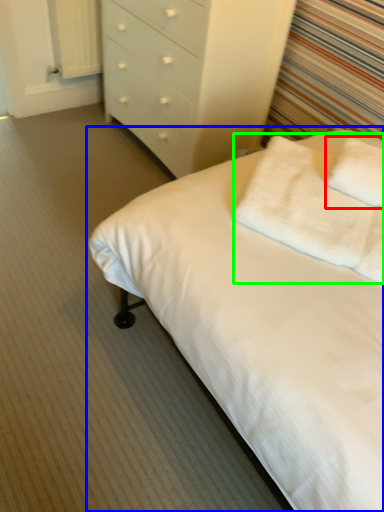
Question: Based on their relative distances, which object is farther from pillow (highlighted by a red box)? Choose from bed (highlighted by a blue box) and pillow (highlighted by a green box).

Choices:
 (A) bed
 (B) pillow

Answer: (A)